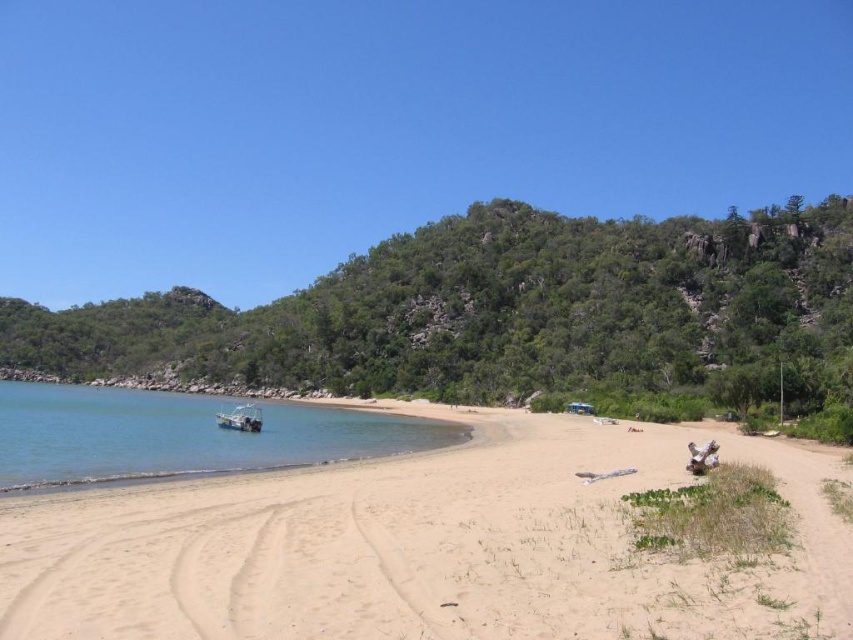
You are standing on the sandy beach in the coastal scene and want to walk from the point at coordinates point (770, 564) to the point at coordinates point (251, 419). According to the scene description, which direction should you head to reach your destination?

Since point (770, 564) is in front of point (251, 419), you should head towards the direction away from the foreground to reach point (251, 419) from point (770, 564).

You are a beachcomber searching for treasures on the light beige sand at lower center and the clear water at lower left. Which area has a larger surface area available for searching?

The clear water at lower left has a larger surface area available for searching because the light beige sand at lower center is smaller than it.